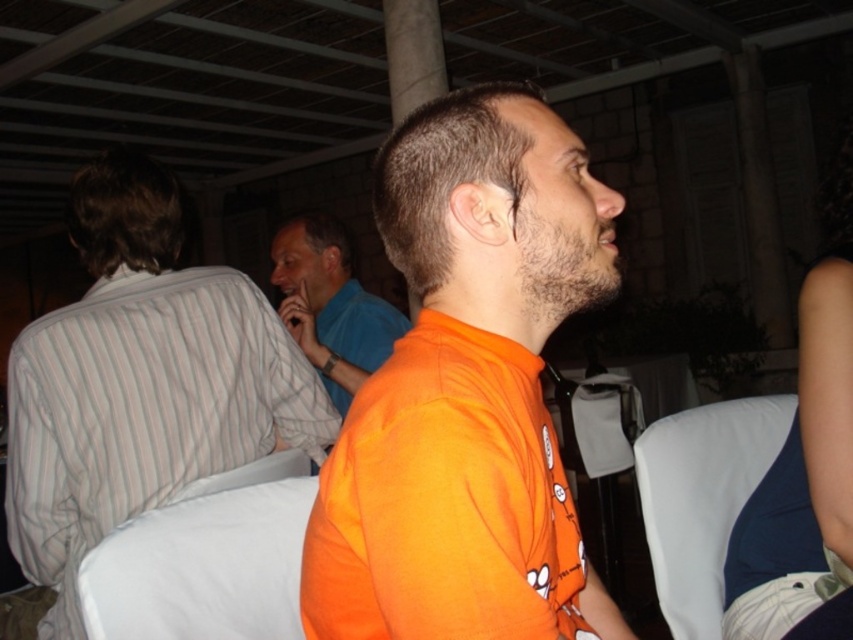
Question: Is the position of white fabric chair at center less distant than that of white fabric chair at right?

Choices:
 (A) yes
 (B) no

Answer: (A)

Question: Among these points, which one is nearest to the camera?

Choices:
 (A) (682, 624)
 (B) (16, 426)
 (C) (312, 365)
 (D) (254, 497)

Answer: (D)

Question: Which object is closer to the camera taking this photo?

Choices:
 (A) white fabric chair at center
 (B) orange cotton shirt at center
 (C) blue smooth shirt at center

Answer: (B)

Question: Is orange cotton shirt at center further to camera compared to white fabric chair at center?

Choices:
 (A) yes
 (B) no

Answer: (B)

Question: Which of these objects is positioned farthest from the blue smooth shirt at center?

Choices:
 (A) white fabric chair at center
 (B) white fabric chair at right

Answer: (A)

Question: Does white fabric chair at center have a greater width compared to white fabric chair at right?

Choices:
 (A) yes
 (B) no

Answer: (B)